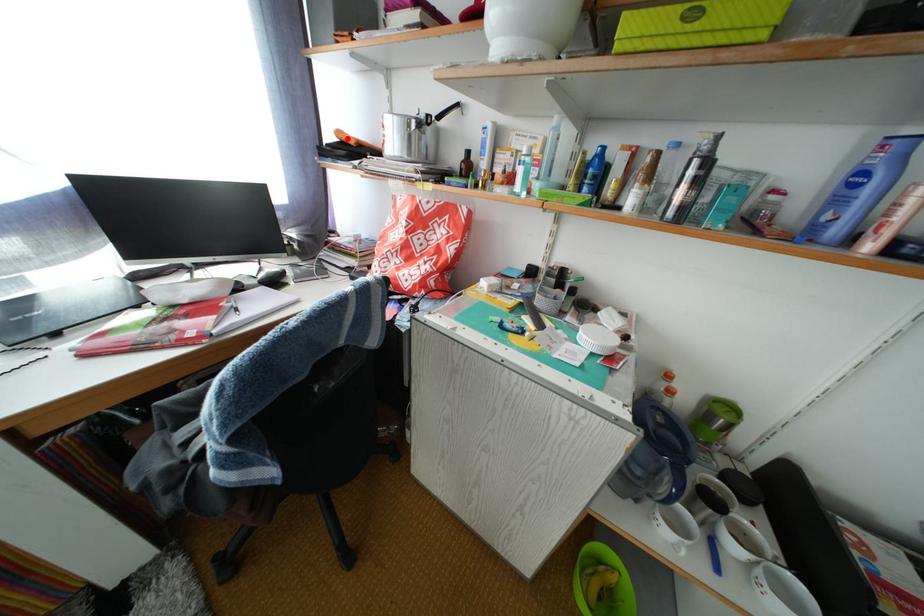
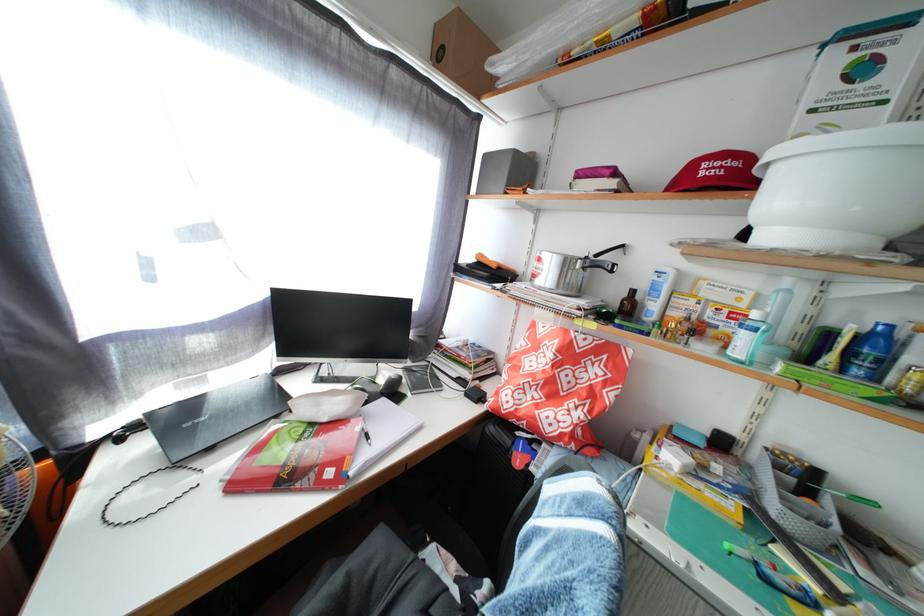
The point at the highlighted location is marked in the first image. Where is the corresponding point in the second image?

(489, 262)